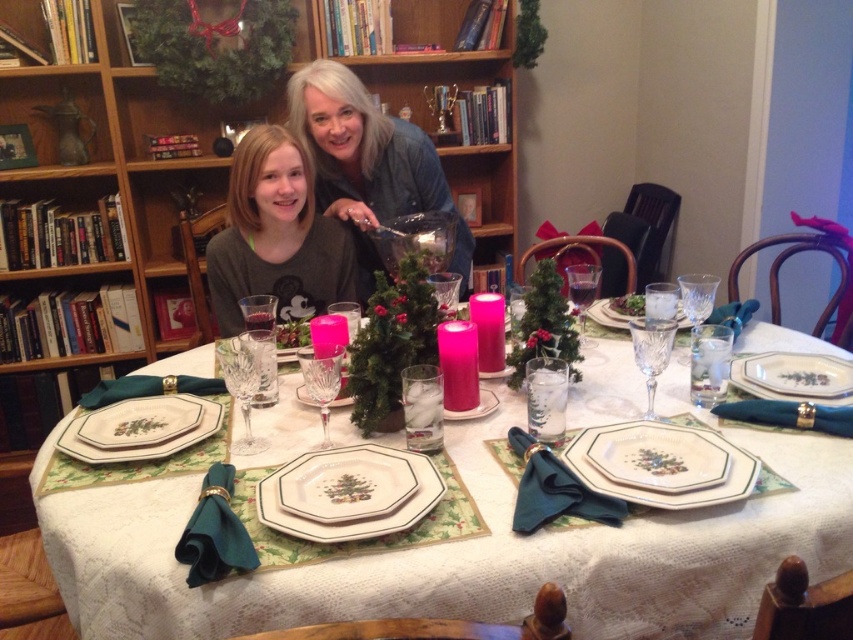
Question: Among these points, which one is nearest to the camera?

Choices:
 (A) (213, 314)
 (B) (383, 209)
 (C) (334, 586)
 (D) (323, 528)

Answer: (C)

Question: Which object is closer to the camera taking this photo?

Choices:
 (A) wooden bookshelf at upper left
 (B) matte gray shirt at center
 (C) porcelain plates at center
 (D) matte blue denim jacket at upper center

Answer: (C)

Question: From the image, what is the correct spatial relationship of matte blue denim jacket at upper center in relation to porcelain floral platter at center?

Choices:
 (A) above
 (B) below

Answer: (A)

Question: Can you confirm if matte gray shirt at center is positioned below matte blue denim jacket at upper center?

Choices:
 (A) yes
 (B) no

Answer: (A)

Question: Which of the following is the farthest from the observer?

Choices:
 (A) (323, 291)
 (B) (347, 72)

Answer: (A)

Question: From the image, what is the correct spatial relationship of porcelain plates at center in relation to matte gray shirt at center?

Choices:
 (A) above
 (B) below

Answer: (B)